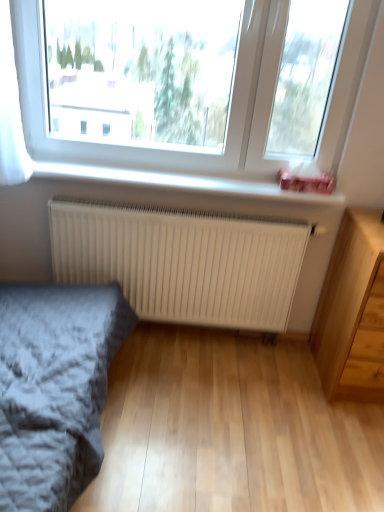
Question: Is the depth of light wood chest of drawers at lower right less than that of white matte radiator at center?

Choices:
 (A) no
 (B) yes

Answer: (B)

Question: Considering the relative positions of light wood chest of drawers at lower right and white matte radiator at center in the image provided, is light wood chest of drawers at lower right to the left of white matte radiator at center from the viewer's perspective?

Choices:
 (A) no
 (B) yes

Answer: (A)

Question: From the image's perspective, would you say light wood chest of drawers at lower right is shown under white matte radiator at center?

Choices:
 (A) no
 (B) yes

Answer: (B)

Question: Can you confirm if light wood chest of drawers at lower right is taller than white matte radiator at center?

Choices:
 (A) no
 (B) yes

Answer: (B)

Question: From the image's perspective, does light wood chest of drawers at lower right appear higher than white matte radiator at center?

Choices:
 (A) yes
 (B) no

Answer: (B)

Question: Is light wood chest of drawers at lower right positioned beyond the bounds of white matte radiator at center?

Choices:
 (A) yes
 (B) no

Answer: (A)

Question: Does light wood chest of drawers at lower right have a greater width compared to white plastic window sill at upper center?

Choices:
 (A) yes
 (B) no

Answer: (A)

Question: Considering the relative positions of light wood chest of drawers at lower right and white plastic window sill at upper center in the image provided, is light wood chest of drawers at lower right to the left of white plastic window sill at upper center from the viewer's perspective?

Choices:
 (A) yes
 (B) no

Answer: (B)

Question: Is light wood chest of drawers at lower right positioned far away from white plastic window sill at upper center?

Choices:
 (A) no
 (B) yes

Answer: (A)

Question: Can you confirm if light wood chest of drawers at lower right is positioned to the right of white plastic window sill at upper center?

Choices:
 (A) yes
 (B) no

Answer: (A)

Question: From a real-world perspective, is light wood chest of drawers at lower right on top of white plastic window sill at upper center?

Choices:
 (A) yes
 (B) no

Answer: (B)

Question: Is light wood chest of drawers at lower right turned away from white plastic window sill at upper center?

Choices:
 (A) yes
 (B) no

Answer: (B)

Question: Can you confirm if white plastic window sill at upper center is wider than light wood chest of drawers at lower right?

Choices:
 (A) yes
 (B) no

Answer: (B)